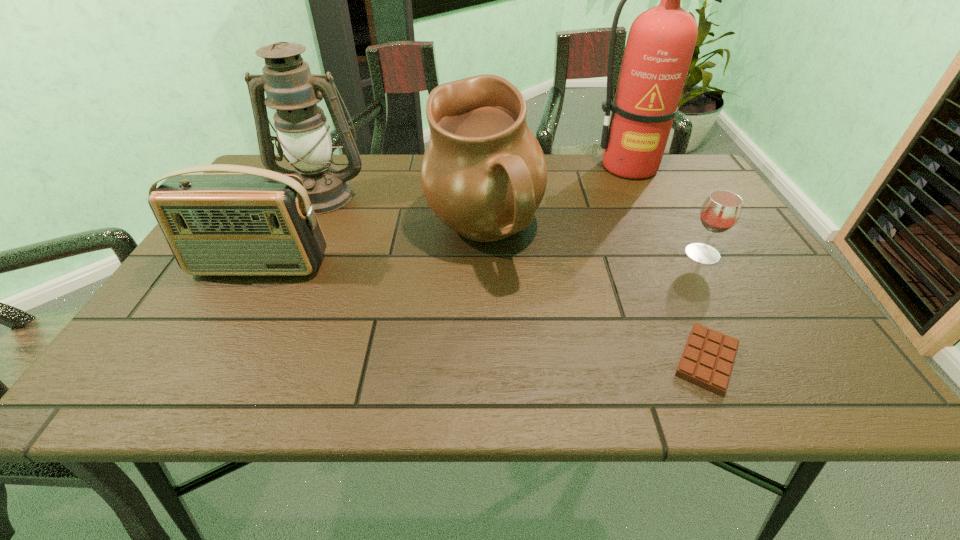
This screenshot has width=960, height=540. What are the coordinates of `free space that satisfies the following two spatial constraints: 1. on the side of the tallest object with the nozzle and handle; 2. at the spout of the fourth shortest object` in the screenshot? It's located at (661, 234).

Identify the location of vacant space that satisfies the following two spatial constraints: 1. at the spout of the third tallest object; 2. on the right side of the shortest object. The height and width of the screenshot is (540, 960). (485, 360).

Find the location of a particular element. The height and width of the screenshot is (540, 960). vacant region that satisfies the following two spatial constraints: 1. on the side of the tallest object with the nozzle and handle; 2. on the right side of the wineglass is located at coordinates (670, 253).

Find the location of a particular element. The width and height of the screenshot is (960, 540). vacant space that satisfies the following two spatial constraints: 1. on the side of the tallest object with the nozzle and handle; 2. at the spout of the third tallest object is located at coordinates (661, 234).